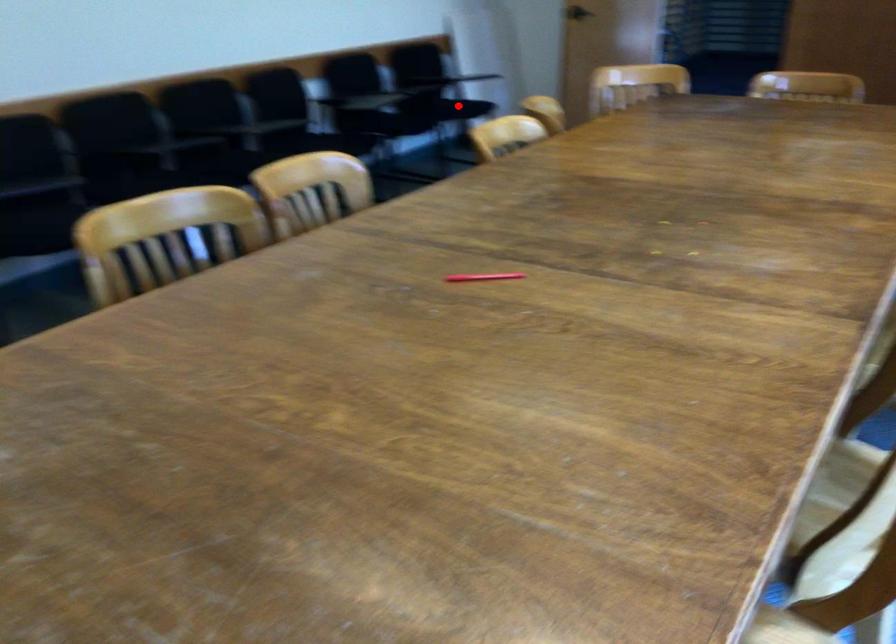
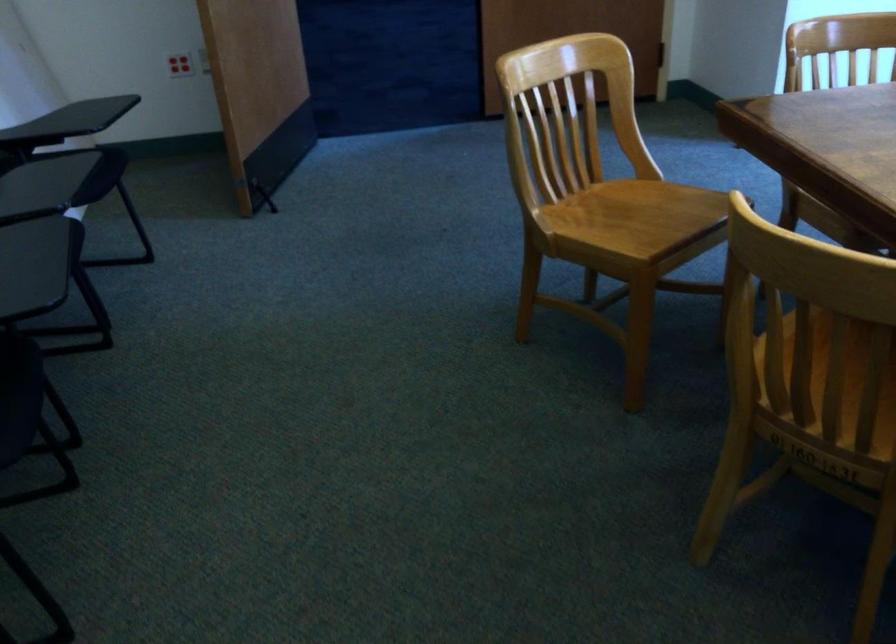
Question: I am providing you with two images of the same scene from different viewpoints. A red point is marked on the first image. Can you still see the location of the red point in image 2?

Choices:
 (A) Yes
 (B) No

Answer: (B)